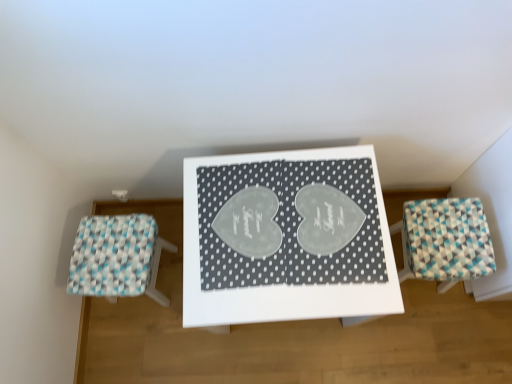
The image size is (512, 384). In order to click on vacant space in front of teal-patterned stool at right, which is the 1th furniture in right-to-left order in this screenshot , I will do `click(431, 331)`.